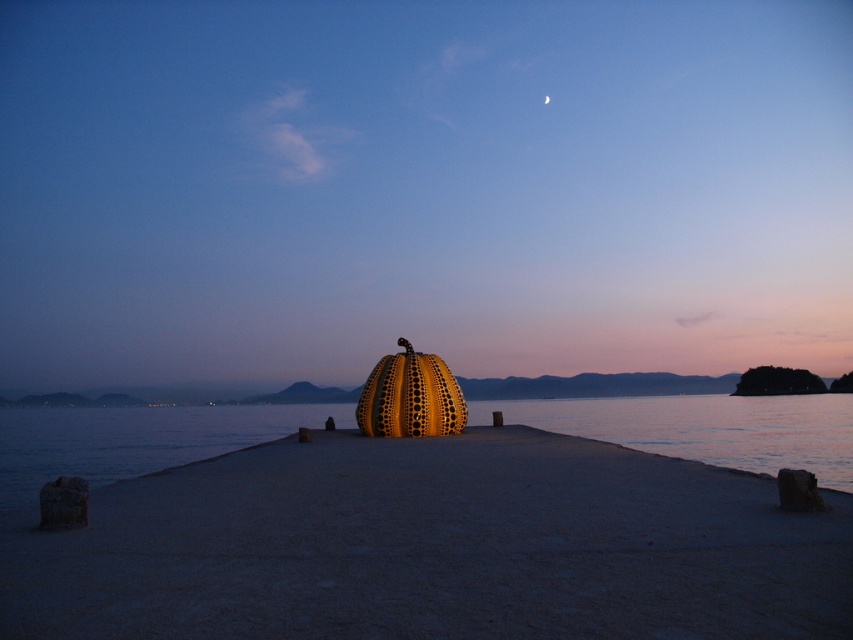
You are a painter wanting to capture the scene of the smooth concrete dock at center and the transparent water at center. Which one appears narrower in your painting?

The smooth concrete dock at center has a lesser width compared to the transparent water at center, so it will appear narrower in the painting.

You are standing on the smooth concrete dock at center and want to look at the transparent water at center. Which direction should you move to see it better?

The smooth concrete dock at center is in front of transparent water at center, so you should move backward to see the transparent water at center better.

You are an artist planning to paint the scene. You need to decide which object, the smooth concrete dock at center or the silver metallic crescent moon at upper center, should be wider in your painting to accurately represent their sizes as seen in the image. Which one should you depict as wider?

The smooth concrete dock at center should be depicted as wider in the painting because its width surpasses that of the silver metallic crescent moon at upper center according to the description.